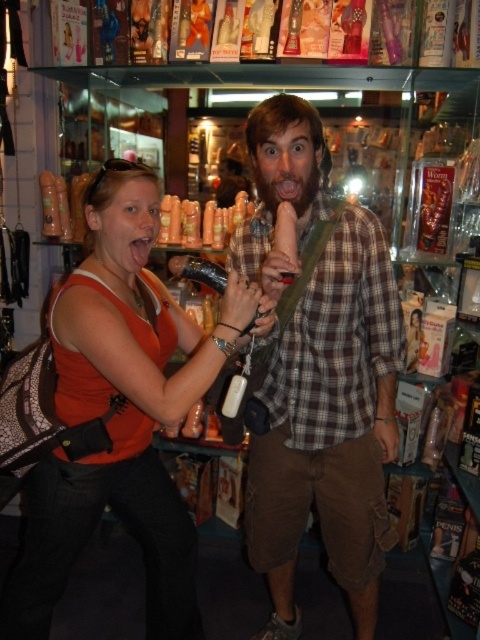
Between plaid fabric shirt at center and orange matte tank top at center, which one has more height?

Standing taller between the two is plaid fabric shirt at center.

Which is in front, point (295, 332) or point (140, 209)?

Point (140, 209) is in front.

The width and height of the screenshot is (480, 640). I want to click on plaid fabric shirt at center, so click(x=328, y=426).

Can you confirm if orange matte tank top at center is thinner than brown fuzzy beard at center?

No.

Does point (237, 285) come behind point (269, 195)?

No, it is not.

Who is more forward, (137,164) or (262,177)?

Point (137,164) is more forward.

I want to click on orange matte tank top at center, so click(x=121, y=412).

Does plaid fabric shirt at center appear over brown fuzzy beard at center?

No, plaid fabric shirt at center is not above brown fuzzy beard at center.

Can you confirm if plaid fabric shirt at center is smaller than brown fuzzy beard at center?

Incorrect, plaid fabric shirt at center is not smaller in size than brown fuzzy beard at center.

This screenshot has height=640, width=480. I want to click on plaid fabric shirt at center, so click(x=328, y=426).

The height and width of the screenshot is (640, 480). What are the coordinates of `plaid fabric shirt at center` in the screenshot? It's located at (328, 426).